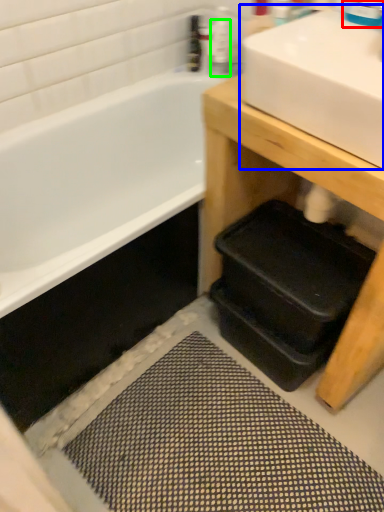
Question: Which is farther away from faucet (highlighted by a red box)? sink (highlighted by a blue box) or toiletry (highlighted by a green box)?

Choices:
 (A) sink
 (B) toiletry

Answer: (B)